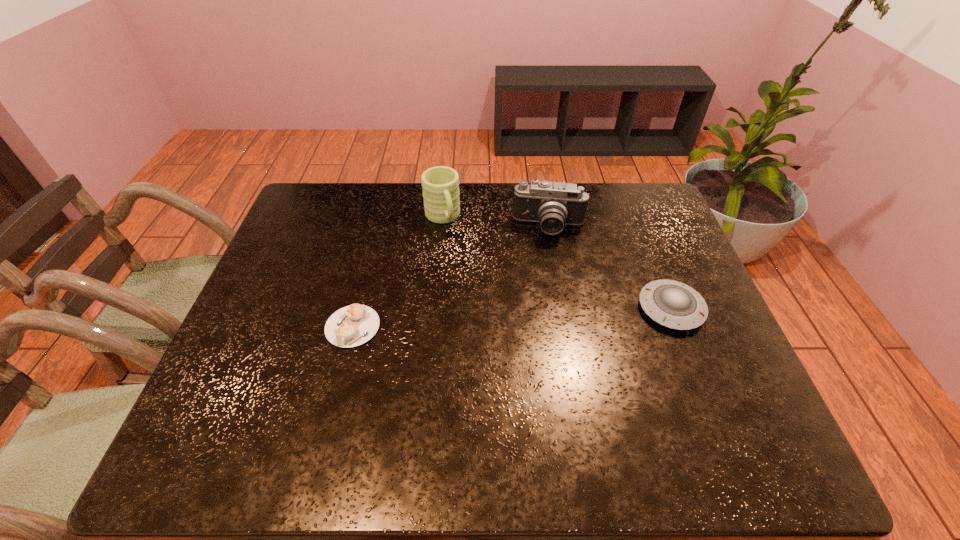
Locate an element on the screen. vacant space positioned 0.280m on the side of the mug with the handle is located at coordinates (476, 299).

Where is `vacant space located on the front-facing side of the third object from left to right`? This screenshot has width=960, height=540. vacant space located on the front-facing side of the third object from left to right is located at coordinates (546, 258).

Locate an element on the screen. vacant space located 0.150m on the front-facing side of the third object from left to right is located at coordinates (545, 278).

In order to click on vacant space located on the front-facing side of the third object from left to right in this screenshot , I will do [x=541, y=353].

Find the location of `mug located at the far edge`. mug located at the far edge is located at coordinates (440, 184).

Where is `camera that is at the far edge`? This screenshot has width=960, height=540. camera that is at the far edge is located at coordinates (553, 204).

Locate an element on the screen. object located at the right edge is located at coordinates (673, 304).

Find the location of a particular element. Image resolution: width=960 pixels, height=540 pixels. free space at the far edge of the desktop is located at coordinates [394, 205].

In the image, there is a desktop. Where is `blank space at the left edge`? This screenshot has height=540, width=960. blank space at the left edge is located at coordinates (265, 326).

What are the coordinates of `blank space at the right edge of the desktop` in the screenshot? It's located at (x=722, y=353).